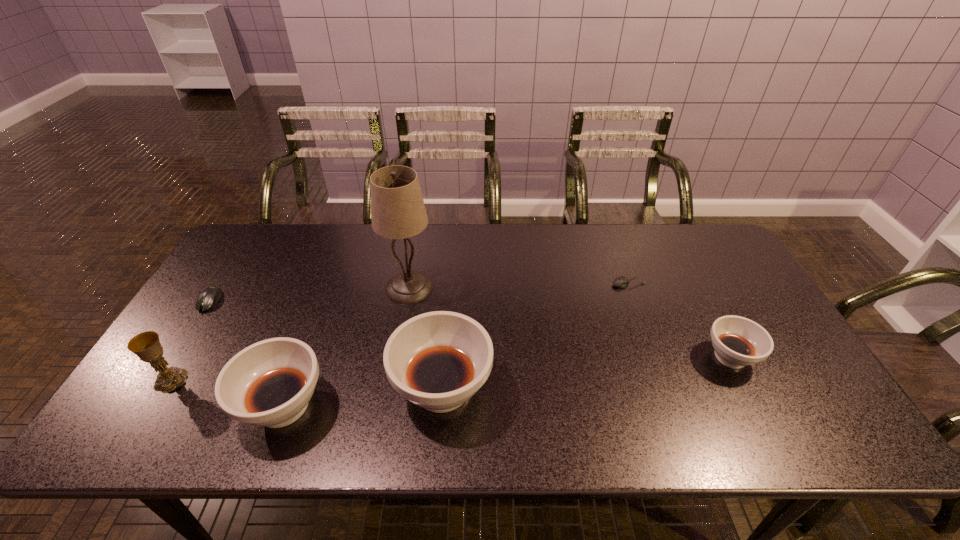
Locate an element on the screen. Image resolution: width=960 pixels, height=540 pixels. the third object from left to right is located at coordinates (269, 383).

Find the location of a particular element. the leftmost soup bowl is located at coordinates (269, 383).

The image size is (960, 540). I want to click on the second soup bowl from left to right, so click(438, 360).

Find the location of a particular element. the shortest soup bowl is located at coordinates (738, 342).

You are a GUI agent. You are given a task and a screenshot of the screen. Output one action in this format:
    pyautogui.click(x=<x>, y=<y>)
    Task: Click on the third shortest object
    The image size is (960, 540).
    Given the screenshot: What is the action you would take?
    pyautogui.click(x=738, y=342)

Where is `the left mouse`? The height and width of the screenshot is (540, 960). the left mouse is located at coordinates (209, 297).

This screenshot has height=540, width=960. Identify the location of the taller mouse. (209, 297).

Identify the location of lampshade. This screenshot has width=960, height=540. (397, 208).

The height and width of the screenshot is (540, 960). Find the location of `the second object from right to left`. the second object from right to left is located at coordinates (621, 282).

This screenshot has height=540, width=960. What are the coordinates of `the shorter mouse` in the screenshot? It's located at click(x=621, y=282).